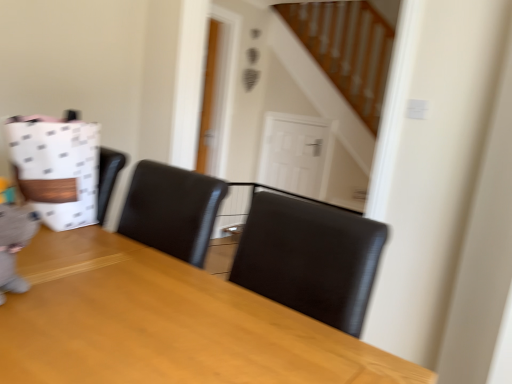
Question: Is wooden table at center facing away from white dotted paper bag at left?

Choices:
 (A) yes
 (B) no

Answer: (B)

Question: Is wooden table at center far from white dotted paper bag at left?

Choices:
 (A) yes
 (B) no

Answer: (B)

Question: Considering the relative positions of wooden table at center and white dotted paper bag at left in the image provided, is wooden table at center to the left of white dotted paper bag at left from the viewer's perspective?

Choices:
 (A) yes
 (B) no

Answer: (B)

Question: Does wooden table at center have a lesser width compared to white dotted paper bag at left?

Choices:
 (A) yes
 (B) no

Answer: (B)

Question: Is wooden table at center aimed at white dotted paper bag at left?

Choices:
 (A) no
 (B) yes

Answer: (A)

Question: In the image, is wooden table at center positioned in front of or behind white glossy door at center?

Choices:
 (A) behind
 (B) front

Answer: (B)

Question: Is wooden table at center taller or shorter than white glossy door at center?

Choices:
 (A) tall
 (B) short

Answer: (A)

Question: Is wooden table at center situated inside white glossy door at center or outside?

Choices:
 (A) outside
 (B) inside

Answer: (A)

Question: In terms of size, does wooden table at center appear bigger or smaller than white glossy door at center?

Choices:
 (A) small
 (B) big

Answer: (B)

Question: Looking at their shapes, would you say white dotted paper bag at left is wider or thinner than wooden table at center?

Choices:
 (A) thin
 (B) wide

Answer: (A)

Question: In the image, is white dotted paper bag at left on the left side or the right side of wooden table at center?

Choices:
 (A) left
 (B) right

Answer: (A)

Question: From the image's perspective, is white dotted paper bag at left located above or below wooden table at center?

Choices:
 (A) above
 (B) below

Answer: (A)

Question: Considering their positions, is white dotted paper bag at left located in front of or behind wooden table at center?

Choices:
 (A) front
 (B) behind

Answer: (B)

Question: Does point (83, 329) appear closer or farther from the camera than point (88, 208)?

Choices:
 (A) farther
 (B) closer

Answer: (B)

Question: From a real-world perspective, is wooden table at center above or below white dotted paper bag at left?

Choices:
 (A) below
 (B) above

Answer: (A)